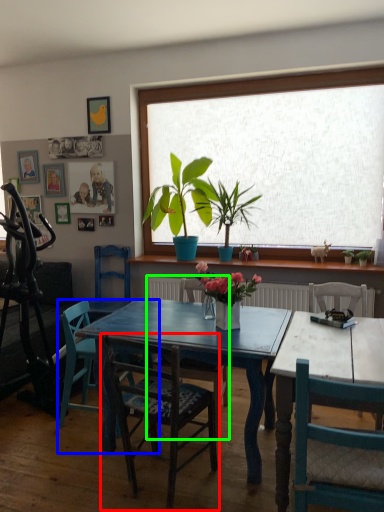
Question: Which object is the farthest from chair (highlighted by a red box)? Choose among these: chair (highlighted by a blue box) or chair (highlighted by a green box).

Choices:
 (A) chair
 (B) chair

Answer: (A)